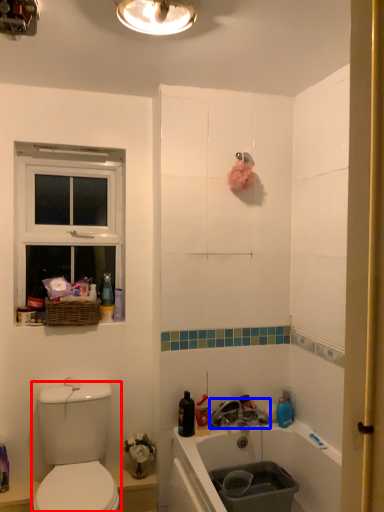
Question: Which object appears farthest to the camera in this image, sink (highlighted by a red box) or tap (highlighted by a blue box)?

Choices:
 (A) sink
 (B) tap

Answer: (B)